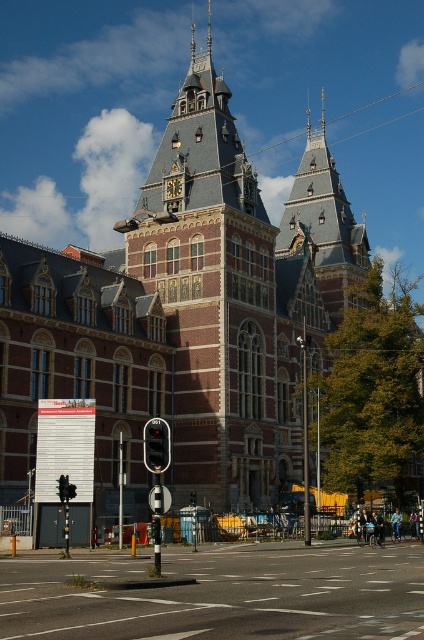
Does point (219, 410) come behind point (156, 465)?

Yes, point (219, 410) is behind point (156, 465).

Can you confirm if red brick tower at center is smaller than black glass traffic light at center?

No.

The width and height of the screenshot is (424, 640). I want to click on red brick tower at center, so click(212, 296).

Locate an element on the screen. The image size is (424, 640). red brick tower at center is located at coordinates (212, 296).

Is point (253, 470) positioned behind point (106, 561)?

Yes.

Does red brick tower at center appear on the right side of smooth asphalt road at center?

Incorrect, red brick tower at center is not on the right side of smooth asphalt road at center.

Does point (256, 292) come in front of point (49, 563)?

No, (256, 292) is further to viewer.

The width and height of the screenshot is (424, 640). Identify the location of red brick tower at center. (212, 296).

Does smooth asphalt road at center appear on the right side of black glass traffic light at center?

Indeed, smooth asphalt road at center is positioned on the right side of black glass traffic light at center.

Locate an element on the screen. smooth asphalt road at center is located at coordinates (223, 595).

The image size is (424, 640). In order to click on smooth asphalt road at center in this screenshot , I will do `click(223, 595)`.